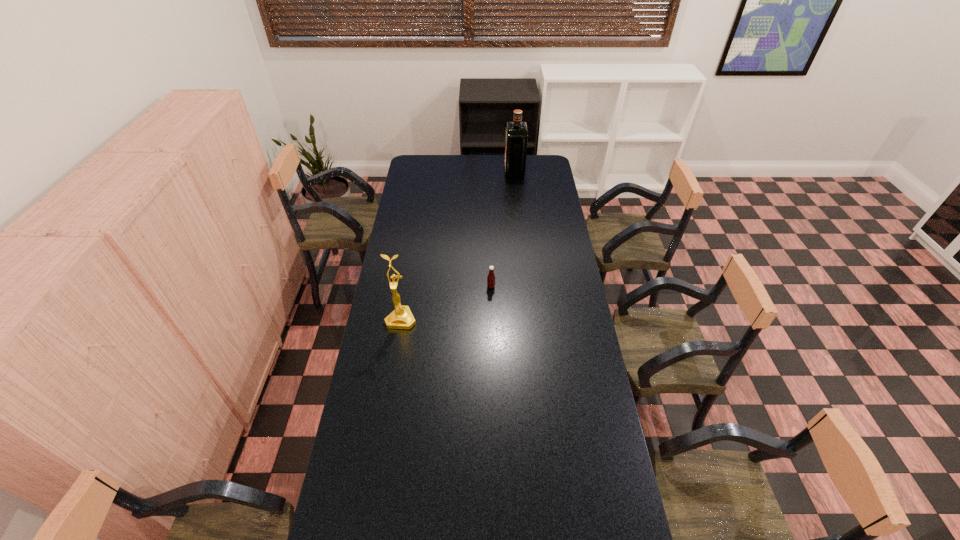
Identify the location of the farthest object. This screenshot has width=960, height=540. (516, 141).

Identify the location of liquor. The width and height of the screenshot is (960, 540). (516, 141).

This screenshot has height=540, width=960. What are the coordinates of `the nearest object` in the screenshot? It's located at (401, 318).

This screenshot has width=960, height=540. Identify the location of award. (401, 318).

This screenshot has width=960, height=540. In order to click on the shortest object in this screenshot , I will do click(491, 277).

Find the location of a particular element. This screenshot has width=960, height=540. the second farthest object is located at coordinates (491, 277).

Where is `vacant space located 0.200m on the front label of the rightmost object`? This screenshot has width=960, height=540. vacant space located 0.200m on the front label of the rightmost object is located at coordinates (471, 172).

At what (x,y) coordinates should I click in order to perform the action: click on vacant space located 0.280m on the front label of the rightmost object. Please return your answer as a coordinate pair (x, y). Looking at the image, I should click on (458, 172).

I want to click on free space located on the front label of the rightmost object, so click(446, 172).

Locate an element on the screen. The height and width of the screenshot is (540, 960). free space located 0.240m on the front-facing side of the leftmost object is located at coordinates (391, 382).